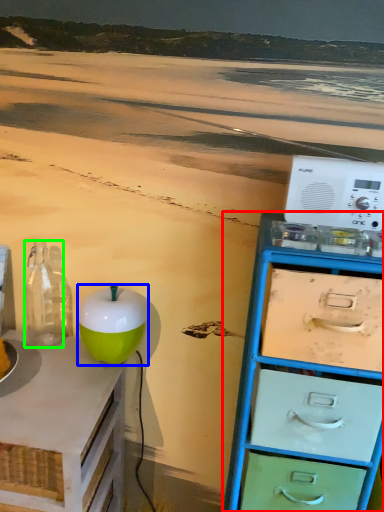
Question: Which is farther away from chest of drawers (highlighted by a red box)? teal (highlighted by a blue box) or bottle (highlighted by a green box)?

Choices:
 (A) teal
 (B) bottle

Answer: (B)